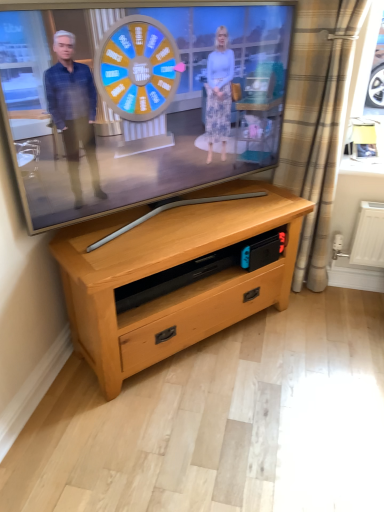
Find the location of a particular element. This screenshot has height=512, width=384. vacant space in between light wood chest of drawers at center and beige plaid curtain at right is located at coordinates (284, 323).